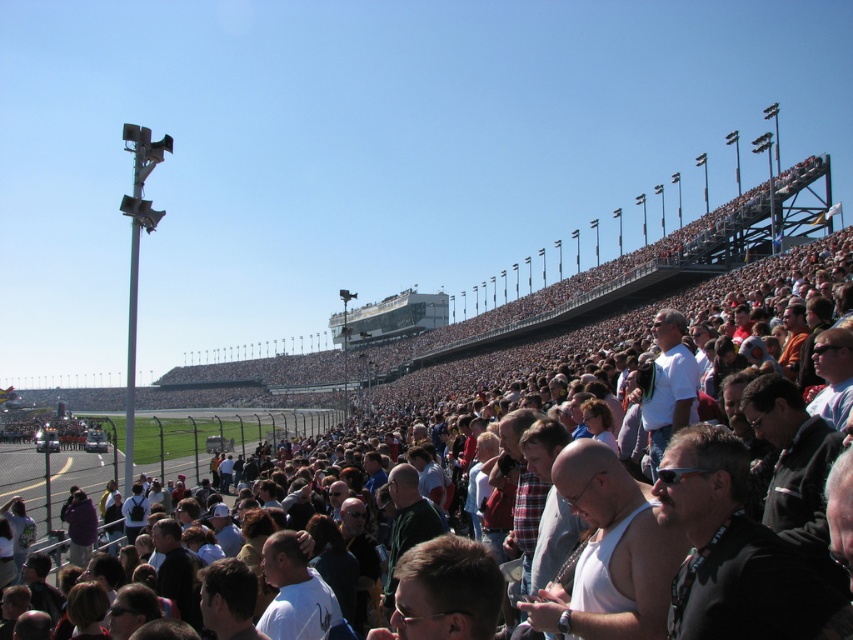
Question: Observing the image, what is the correct spatial positioning of white tank top at center in reference to white matte shirt at center?

Choices:
 (A) above
 (B) below

Answer: (A)

Question: Among these points, which one is farthest from the camera?

Choices:
 (A) coord(68,509)
 (B) coord(556,624)
 (C) coord(322,609)

Answer: (A)

Question: Which point is farther from the camera taking this photo?

Choices:
 (A) (77, 544)
 (B) (271, 554)

Answer: (A)

Question: Is white matte shirt at center in front of purple fabric jacket at lower left?

Choices:
 (A) no
 (B) yes

Answer: (B)

Question: Which of the following is the closest to the observer?

Choices:
 (A) (88, 525)
 (B) (265, 564)
 (C) (584, 604)

Answer: (C)

Question: Is white tank top at center further to the viewer compared to purple fabric jacket at lower left?

Choices:
 (A) no
 (B) yes

Answer: (A)